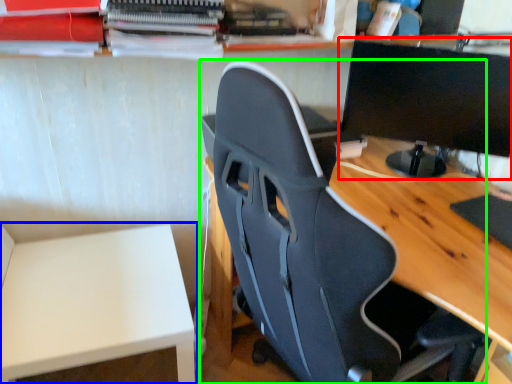
Question: Which is nearer to the computer monitor (highlighted by a red box)? table (highlighted by a blue box) or chair (highlighted by a green box).

Choices:
 (A) table
 (B) chair

Answer: (B)